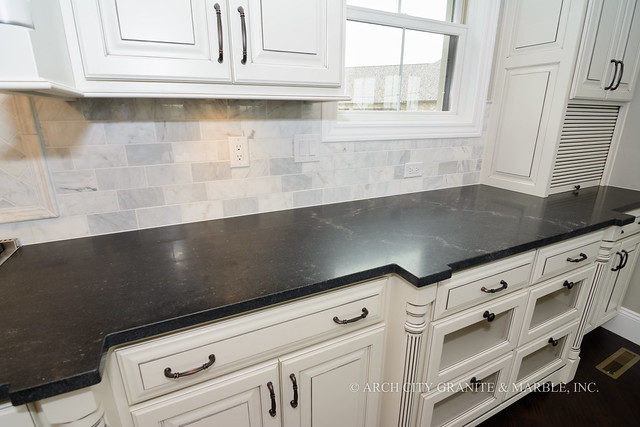
Where is `cabinets`? The width and height of the screenshot is (640, 427). cabinets is located at coordinates (345, 383), (249, 396), (253, 46), (593, 51), (633, 62).